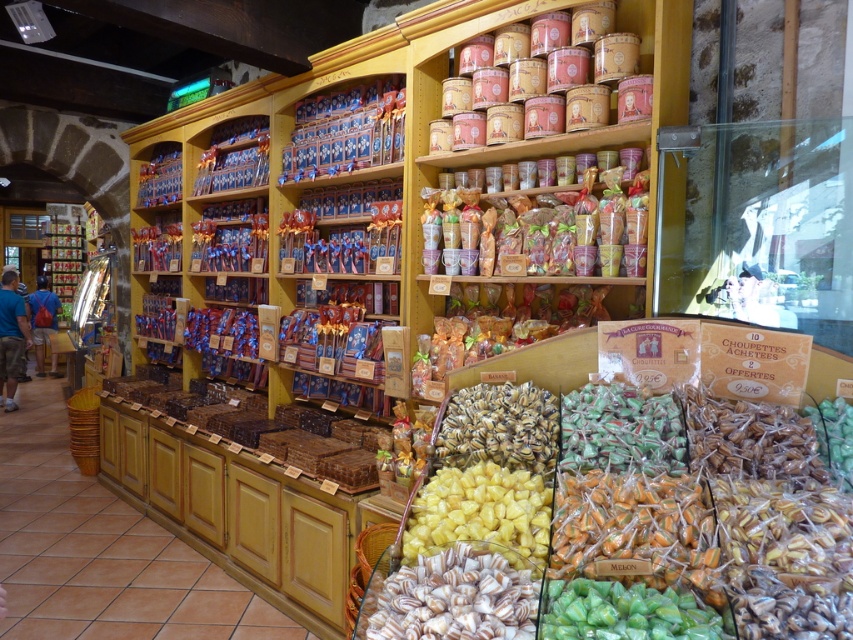
You are a customer in the confectionery shop and want to buy both the white glossy candy at center and the brown matte candy at center. Which one is located lower on the shelf?

The white glossy candy at center is located lower than the brown matte candy at center.

You are a customer in the confectionery shop and want to choose a candy that is taller between the white glossy candy at center and the brown matte candy at center. Which one should you pick?

The brown matte candy at center is taller than the white glossy candy at center, so you should pick the brown matte candy at center.